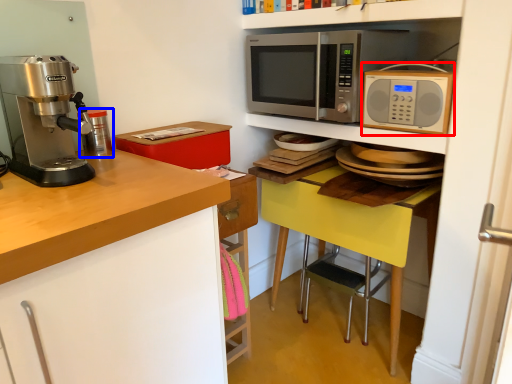
Question: Which object appears closest to the camera in this image, microwave oven (highlighted by a red box) or appliance (highlighted by a blue box)?

Choices:
 (A) microwave oven
 (B) appliance

Answer: (B)